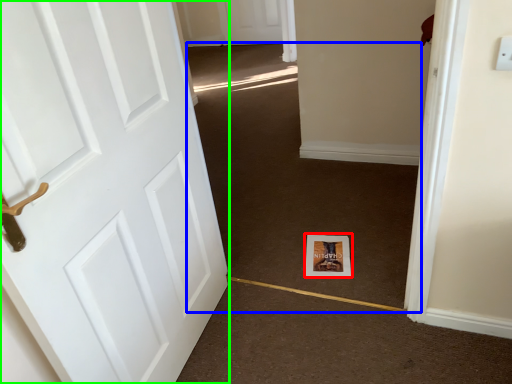
Question: Based on their relative distances, which object is farther from print (highlighted by a red box)? Choose from plain (highlighted by a blue box) and door (highlighted by a green box).

Choices:
 (A) plain
 (B) door

Answer: (B)